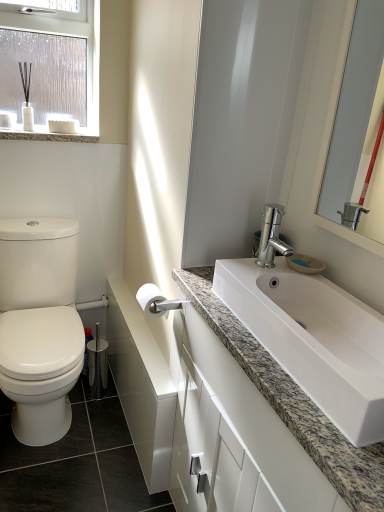
Question: Relative to granite countertop at upper left, is white matte toilet paper at center in front or behind?

Choices:
 (A) front
 (B) behind

Answer: (A)

Question: Visually, is white matte toilet paper at center positioned to the left or to the right of granite countertop at upper left?

Choices:
 (A) left
 (B) right

Answer: (B)

Question: Which object is the closest to the white granite sink at center?

Choices:
 (A) white glossy cabinet at lower center
 (B) granite countertop at upper left
 (C) white matte toilet paper at center
 (D) clear plastic window at upper left
 (E) white glossy cabinet at lower right

Answer: (E)

Question: Which of these objects is positioned farthest from the white glossy cabinet at lower right?

Choices:
 (A) white glossy mirror at upper right
 (B) granite countertop at upper left
 (C) white matte toilet paper at center
 (D) white glossy cabinet at lower center
 (E) white granite sink at center

Answer: (B)